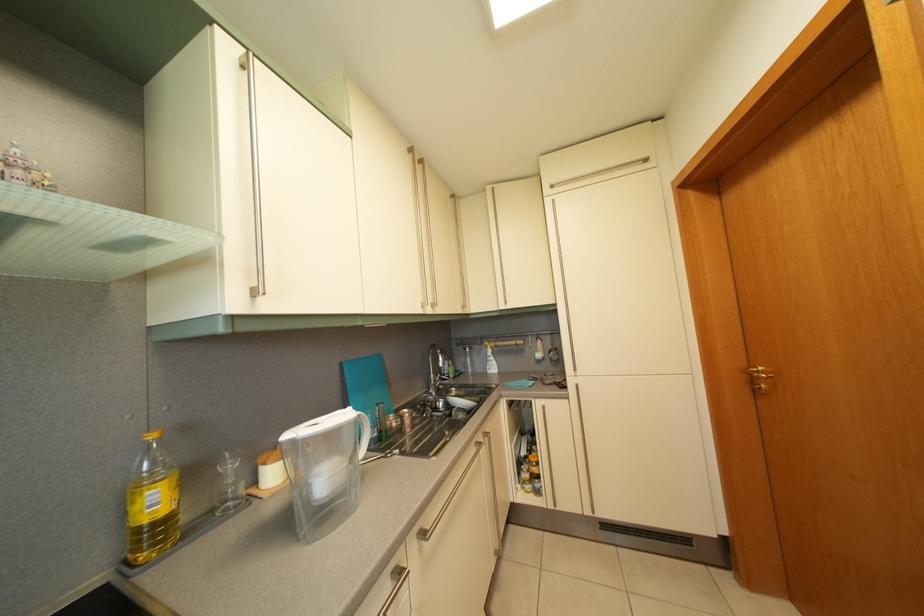
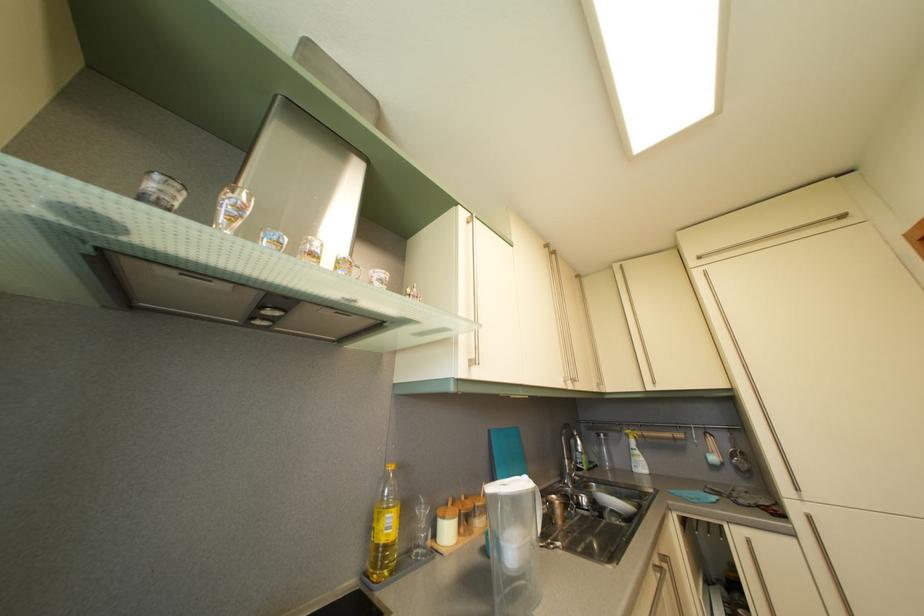
Find the pixel in the second image that matches (349,371) in the first image.

(497, 439)